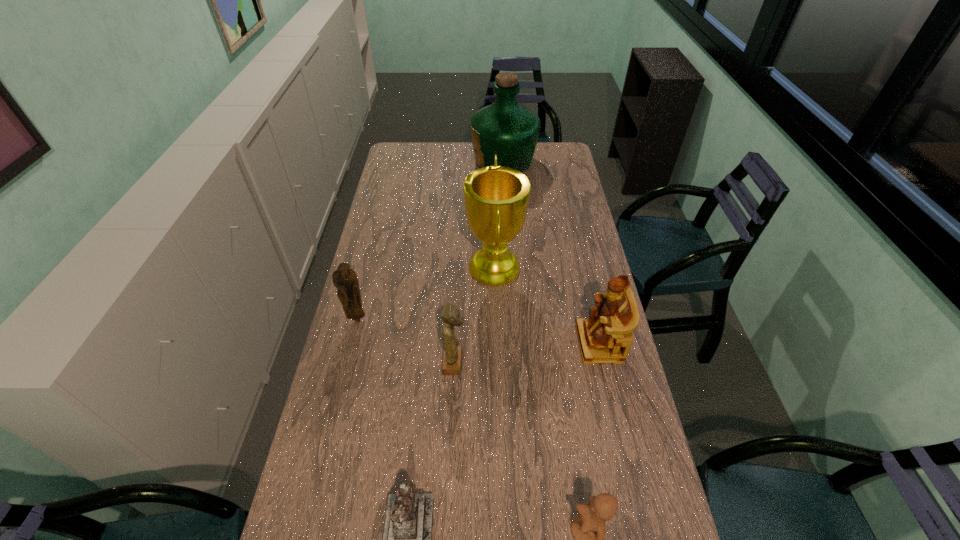
The image size is (960, 540). Find the location of `liquor`. liquor is located at coordinates (505, 128).

Locate an element on the screen. The width and height of the screenshot is (960, 540). award is located at coordinates (496, 198).

The image size is (960, 540). Identify the location of the rightmost object. (606, 336).

Where is `the fifth nearest object`? This screenshot has height=540, width=960. the fifth nearest object is located at coordinates (345, 279).

This screenshot has height=540, width=960. Find the location of `the leftmost figurine`. the leftmost figurine is located at coordinates (345, 279).

You are a GUI agent. You are given a task and a screenshot of the screen. Output one action in this format:
    pyautogui.click(x=<x>, y=<y>)
    Task: Click on the vacant space situated 0.380m on the label side of the liquor
    
    Given the screenshot: What is the action you would take?
    [x=393, y=161]

Identify the location of vacant region located on the label side of the liquor. (455, 161).

Find the location of a particular element. vacant space located 0.070m on the label side of the liquor is located at coordinates (455, 161).

Locate an element on the screen. This screenshot has height=540, width=960. vacant point located 0.360m on the shiny surface of the award is located at coordinates (370, 268).

This screenshot has height=540, width=960. Find the location of `vacant space located 0.290m on the shiny surface of the award`. vacant space located 0.290m on the shiny surface of the award is located at coordinates (388, 268).